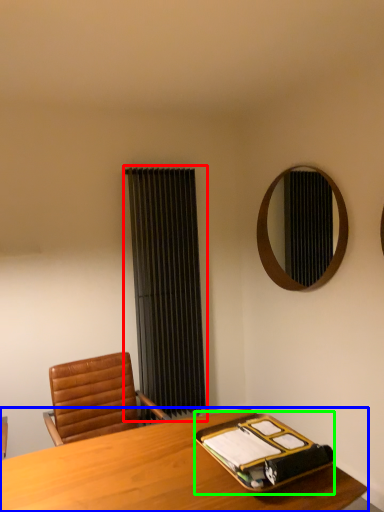
Question: Which is farther away from curtain (highlighted by a red box)? desk (highlighted by a blue box) or binder (highlighted by a green box)?

Choices:
 (A) desk
 (B) binder

Answer: (B)